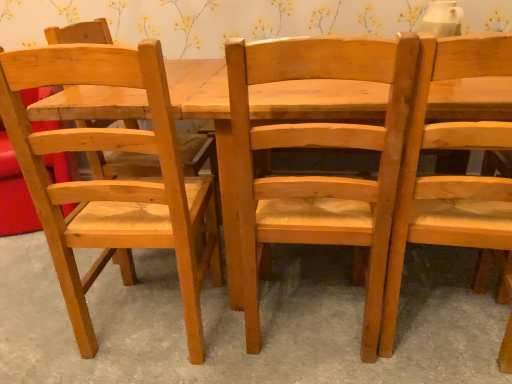
Question: Is natural wood chair at center, which is the second chair from left to right, in front of or behind natural wood chair at right, the 3th chair viewed from the left, in the image?

Choices:
 (A) behind
 (B) front

Answer: (A)

Question: From the image's perspective, is natural wood chair at center, which is the second chair from left to right, located above or below natural wood chair at right, the 1th chair from the right?

Choices:
 (A) above
 (B) below

Answer: (A)

Question: Which object is the closest to the natural wood chair at center, marked as the second chair in a right-to-left arrangement?

Choices:
 (A) natural wood chair at left, the 3th chair viewed from the right
 (B) natural wood chair at center
 (C) natural wood chair at right, the 1th chair from the right

Answer: (C)

Question: Which object is the farthest from the natural wood chair at center?

Choices:
 (A) natural wood chair at right, the 3th chair viewed from the left
 (B) natural wood chair at left, placed as the first chair when sorted from left to right
 (C) natural wood chair at center, which is the second chair from left to right

Answer: (A)